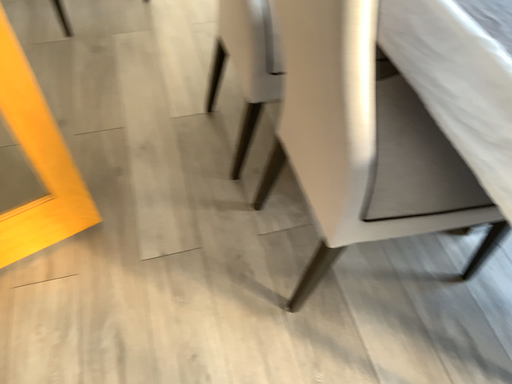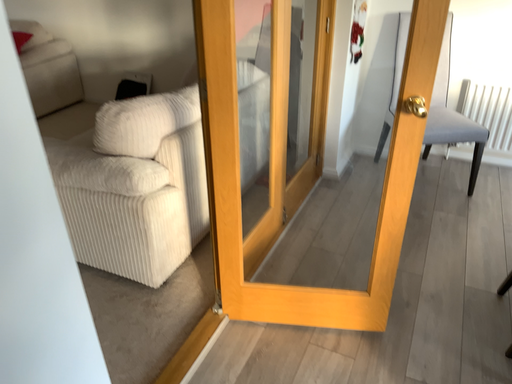
Question: How did the camera likely rotate when shooting the video?

Choices:
 (A) rotated left
 (B) rotated right

Answer: (A)